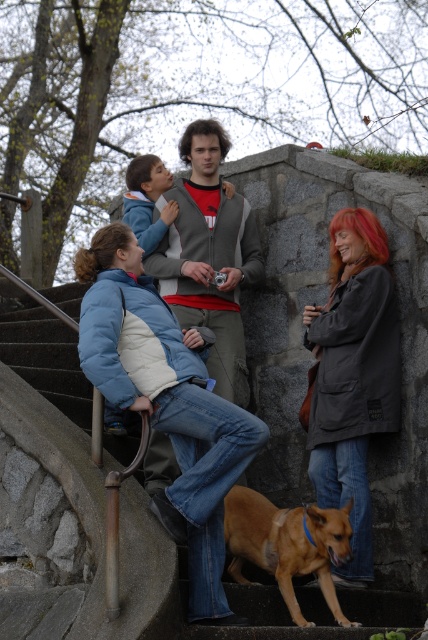
Can you confirm if blue denim jacket at left is taller than brown furry dog at lower center?

Yes.

Which of these two, blue denim jacket at left or brown furry dog at lower center, stands taller?

With more height is blue denim jacket at left.

Identify the location of blue denim jacket at left. The height and width of the screenshot is (640, 428). (166, 400).

Find the location of a particular element. The width and height of the screenshot is (428, 640). gray fleece jacket at center is located at coordinates (208, 253).

Is point (217, 177) in front of point (278, 556)?

No.

Find the location of a particular element. The image size is (428, 640). gray fleece jacket at center is located at coordinates pos(208,253).

This screenshot has width=428, height=640. In order to click on gray fleece jacket at center in this screenshot , I will do `click(208, 253)`.

Does matte gray coat at center have a greater height compared to brown furry dog at lower center?

Yes, matte gray coat at center is taller than brown furry dog at lower center.

Between matte gray coat at center and brown furry dog at lower center, which one is positioned higher?

matte gray coat at center is higher up.

Is point (345, 346) behind point (321, 577)?

Yes, point (345, 346) is behind point (321, 577).

The height and width of the screenshot is (640, 428). I want to click on matte gray coat at center, so click(353, 376).